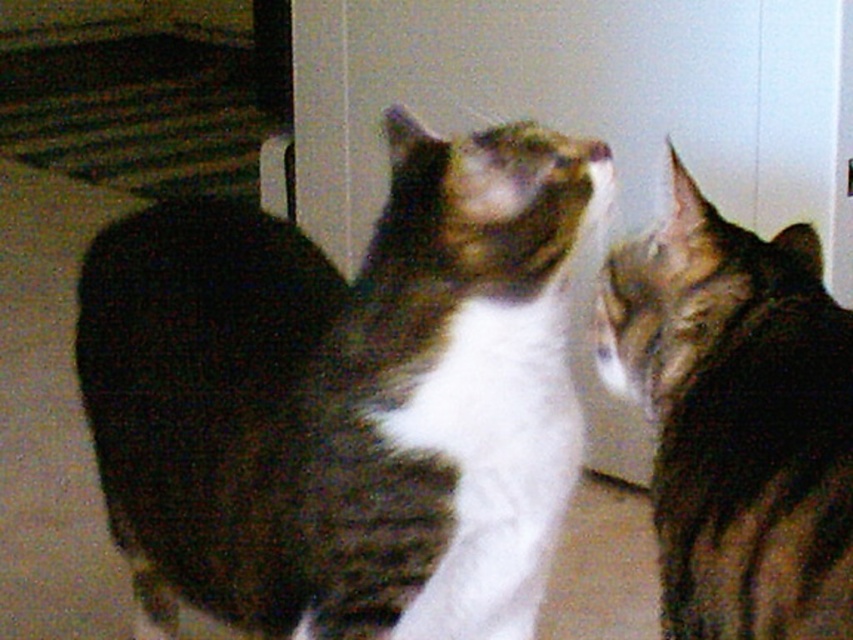
Can you confirm if white fur cat at center is positioned above tabby fur cat at right?

Actually, white fur cat at center is below tabby fur cat at right.

Is point (549, 435) more distant than point (764, 595)?

Yes, point (549, 435) is behind point (764, 595).

Is point (316, 285) less distant than point (686, 396)?

No, it is behind (686, 396).

Find the location of a particular element. white fur cat at center is located at coordinates (345, 397).